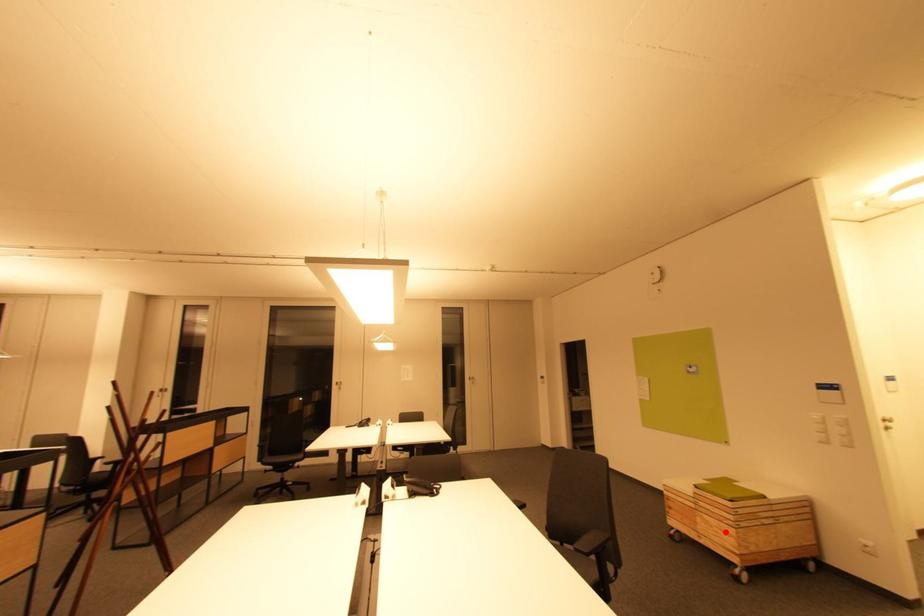
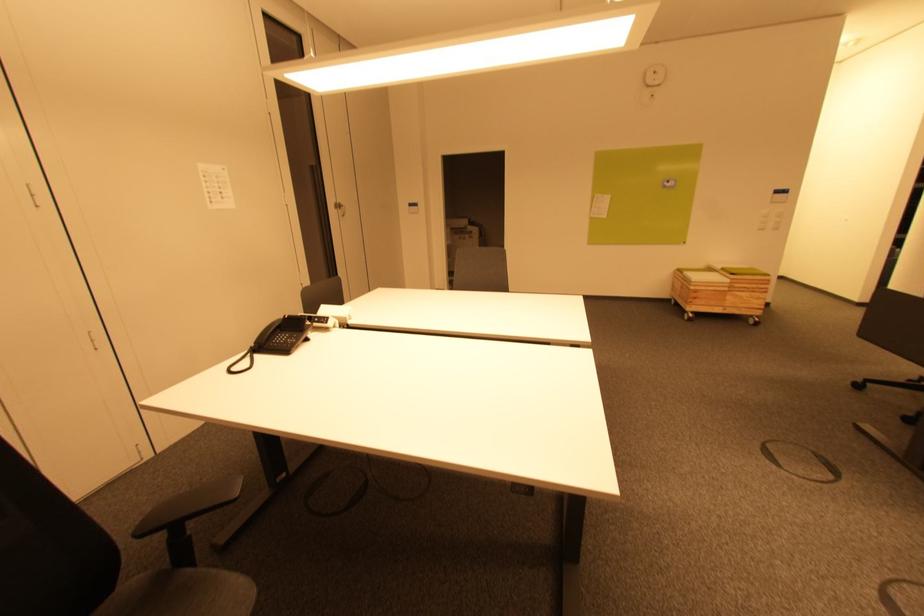
Locate, in the second image, the point that corresponds to the highlighted location in the first image.

(756, 300)